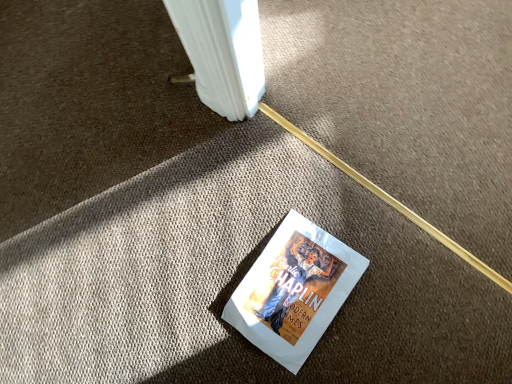
In order to click on free spot in front of white paper at center in this screenshot , I will do `click(354, 355)`.